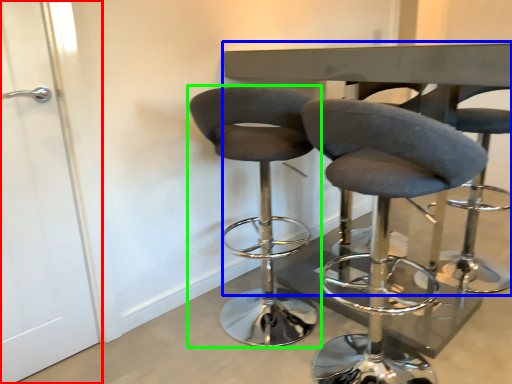
Question: Based on their relative distances, which object is farther from screen door (highlighted by a red box)? Choose from round table (highlighted by a blue box) and chair (highlighted by a green box).

Choices:
 (A) round table
 (B) chair

Answer: (A)